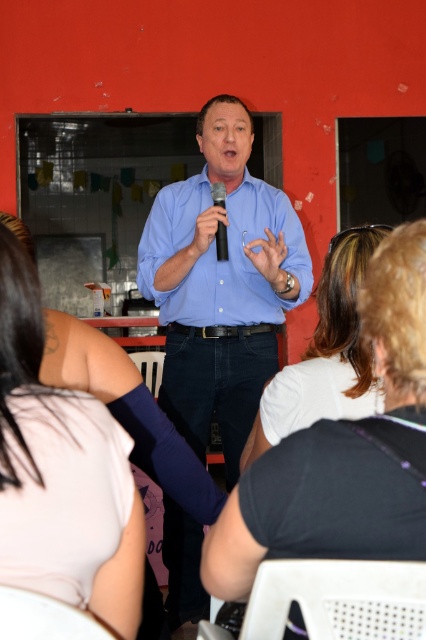
You are standing at the entrance of the room and want to locate the white fabric shirt at center. According to the coordinates provided, in which direction should you look relative to your position?

The white fabric shirt at center is located at coordinates point (344, 451), which would be to your right and slightly forward from your position at the entrance.

You are standing at point (28, 312) and want to walk to point (296, 634). Based on the scene description, is the path between these two points clear of any obstacles?

The path between point (28, 312) and point (296, 634) is clear of obstacles because the scene describes a casual indoor setting with individuals seated on chairs facing the presenter, and there are no mentions of obstacles blocking the path between these points.